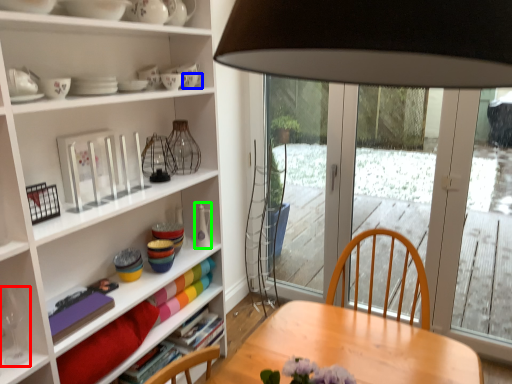
Question: Based on their relative distances, which object is nearer to wine glass (highlighted by a red box)? Choose from tableware (highlighted by a blue box) and tableware (highlighted by a green box).

Choices:
 (A) tableware
 (B) tableware

Answer: (B)